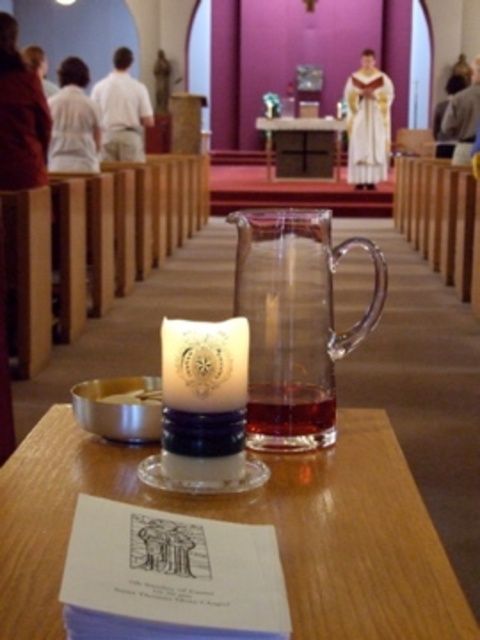
You are standing in the church and want to light the white wax candle at center. To do so, you need to know its exact position. Based on the coordinate system where the bottom left corner of the image is the origin, can you determine if the candle is closer to the left or right side of the image?

The white wax candle at center is located at point (204, 364). Since the x coordinate is 0.570, which is greater than 0.5, it is closer to the right side of the image.

You are standing in the church and want to place a small decoration exactly 24 inches away from where you are standing. Can you use the point at point (29, 433) as the location for the decoration?

The distance between point (29, 433) and the viewer is 23.47 inches, which is slightly less than 24 inches. Therefore, placing the decoration at point (29, 433) would be too close, so you need to move it a little further away to meet the 24 inches requirement.

You are a guest at the church and want to place a small book on the translucent glass table at center without it getting wet from the transparent glass jug at center. Is the table safe to place the book there?

The translucent glass table at center is positioned under the transparent glass jug at center, so the jug may drip or pour liquid onto the table. It might not be safe to place the book there as it could get wet.